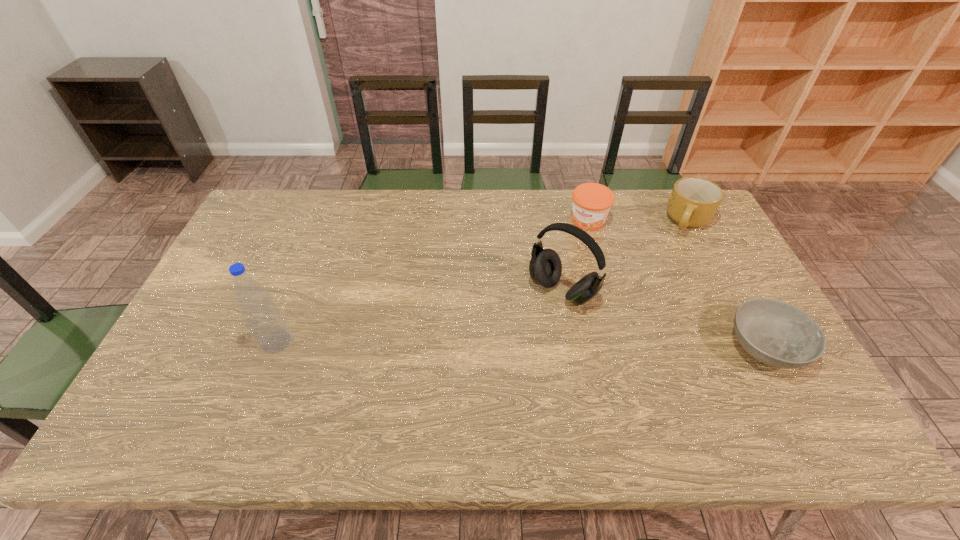
This screenshot has height=540, width=960. In order to click on bowl that is positioned at the right edge in this screenshot , I will do `click(776, 333)`.

Where is `mug located at the right edge`? The width and height of the screenshot is (960, 540). mug located at the right edge is located at coordinates (693, 203).

Find the location of a particular element. object present at the far right corner is located at coordinates (693, 203).

Find the location of a particular element. This screenshot has width=960, height=540. object at the near right corner is located at coordinates (776, 333).

You are a GUI agent. You are given a task and a screenshot of the screen. Output one action in this format:
    pyautogui.click(x=<x>, y=<y>)
    Task: Click on the free space at the far edge of the desktop
    
    Given the screenshot: What is the action you would take?
    pyautogui.click(x=360, y=207)

You are a GUI agent. You are given a task and a screenshot of the screen. Output one action in this format:
    pyautogui.click(x=<x>, y=<y>)
    Task: Click on the vacant point at the left edge
    The width and height of the screenshot is (960, 540).
    Given the screenshot: What is the action you would take?
    pyautogui.click(x=237, y=332)

You are a GUI agent. You are given a task and a screenshot of the screen. Output one action in this format:
    pyautogui.click(x=<x>, y=<y>)
    Task: Click on the free space at the right edge of the desktop
    This screenshot has width=960, height=540.
    Given the screenshot: What is the action you would take?
    pyautogui.click(x=703, y=246)

Where is `vacant space at the far left corner of the desktop`? Image resolution: width=960 pixels, height=540 pixels. vacant space at the far left corner of the desktop is located at coordinates (264, 193).

The height and width of the screenshot is (540, 960). In the image, there is a desktop. What are the coordinates of `vacant space at the near left corner` in the screenshot? It's located at (149, 391).

You are a GUI agent. You are given a task and a screenshot of the screen. Output one action in this format:
    pyautogui.click(x=<x>, y=<y>)
    Task: Click on the free space between the shortest object and the second tallest object
    This screenshot has width=960, height=540.
    Given the screenshot: What is the action you would take?
    (664, 319)